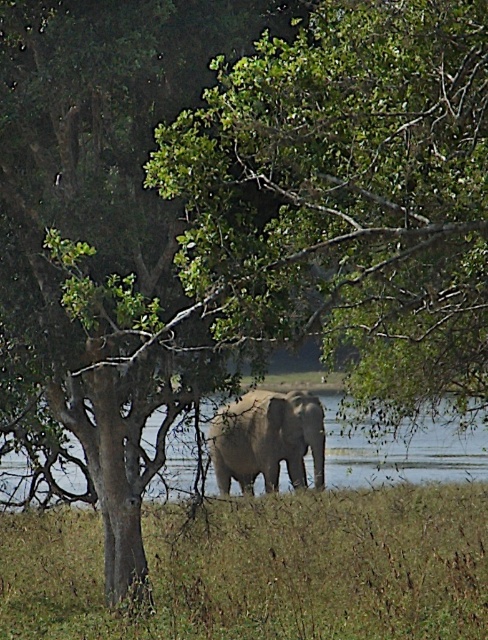
You are a wildlife photographer aiming to capture a clear shot of the gray textured elephant at center. However, there is clear water at elephant center in the way. Can you adjust your angle to avoid the water while still keeping the elephant in the frame?

The clear water at elephant center is positioned under the gray textured elephant at center, so you can adjust your angle upwards to focus on the elephant while avoiding the water below.

You are a wildlife photographer aiming to capture a photo of the gray textured elephant at center without the clear water at elephant center in the frame. Based on the scene description, can you position yourself in a way to exclude the water from the photo?

The clear water at elephant center is wider than the gray textured elephant at center. To exclude the water, position yourself so that only the elephant fits within the frame, as the water is wider and might require a wider angle to include both. Adjust your camera angle to focus solely on the elephant, avoiding the broader area of water.